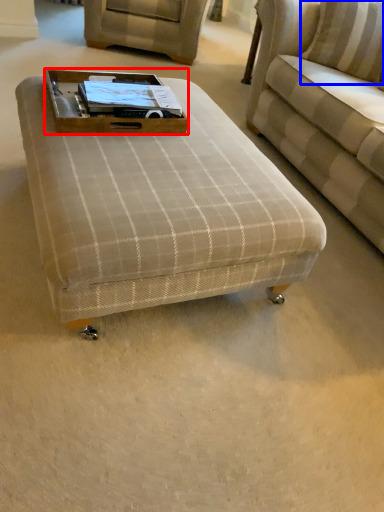
Question: Which point is further to the camera, side table (highlighted by a red box) or pillow (highlighted by a blue box)?

Choices:
 (A) side table
 (B) pillow

Answer: (B)